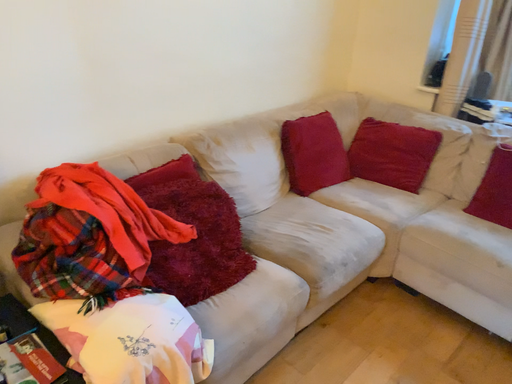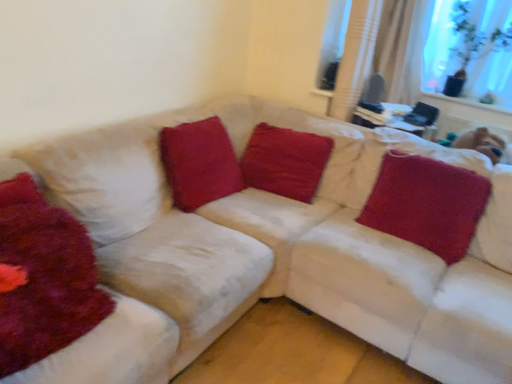
Question: Which way did the camera rotate in the video?

Choices:
 (A) rotated left
 (B) rotated right

Answer: (B)